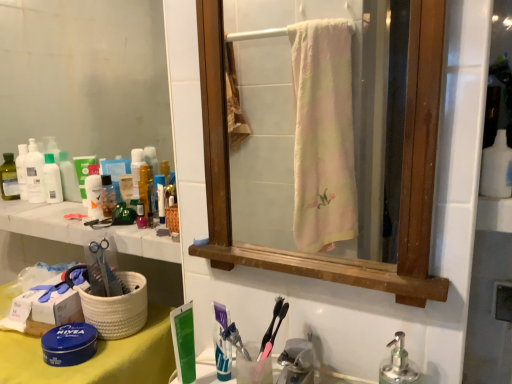
The image size is (512, 384). Find the location of `blank space situated above white marble counter at upper left (from a real-world perspective)`. blank space situated above white marble counter at upper left (from a real-world perspective) is located at coordinates (72, 214).